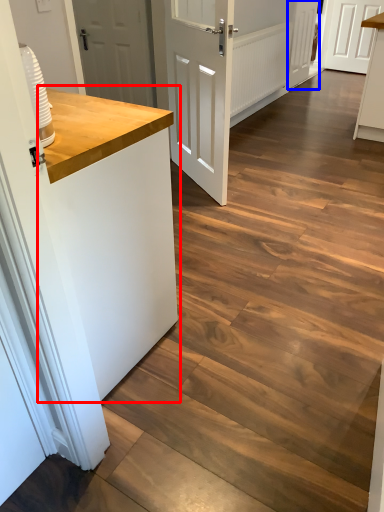
Question: Among these objects, which one is farthest to the camera, counter top (highlighted by a red box) or door (highlighted by a blue box)?

Choices:
 (A) counter top
 (B) door

Answer: (B)